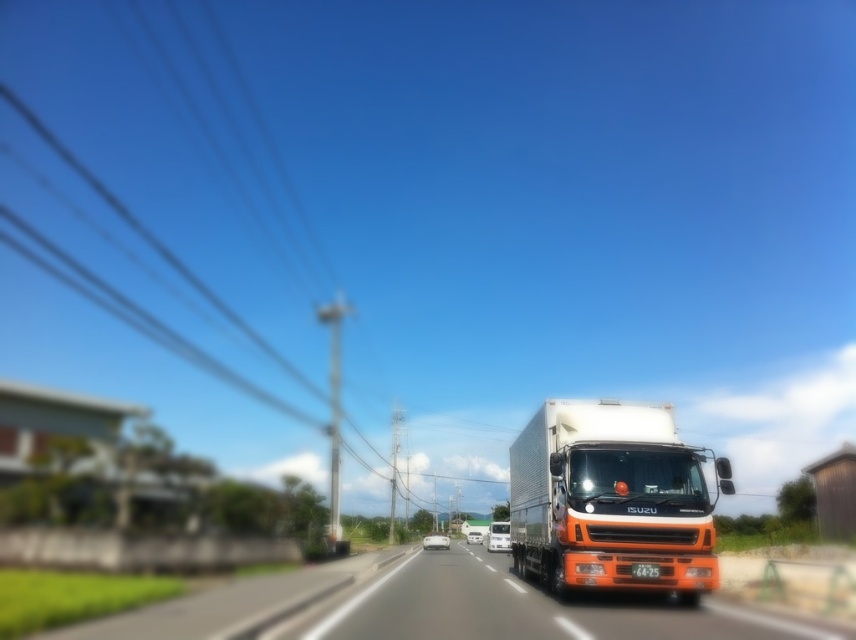
Question: Does orange matte truck at center come behind orange matte trailer truck at center?

Choices:
 (A) no
 (B) yes

Answer: (A)

Question: Among these points, which one is farthest from the camera?

Choices:
 (A) (726, 612)
 (B) (542, 488)

Answer: (B)

Question: Which of the following is the farthest from the observer?

Choices:
 (A) orange matte truck at center
 (B) orange matte trailer truck at center

Answer: (B)

Question: Does orange matte truck at center lie behind orange matte trailer truck at center?

Choices:
 (A) no
 (B) yes

Answer: (A)

Question: Is orange matte truck at center to the left of orange matte trailer truck at center from the viewer's perspective?

Choices:
 (A) yes
 (B) no

Answer: (A)